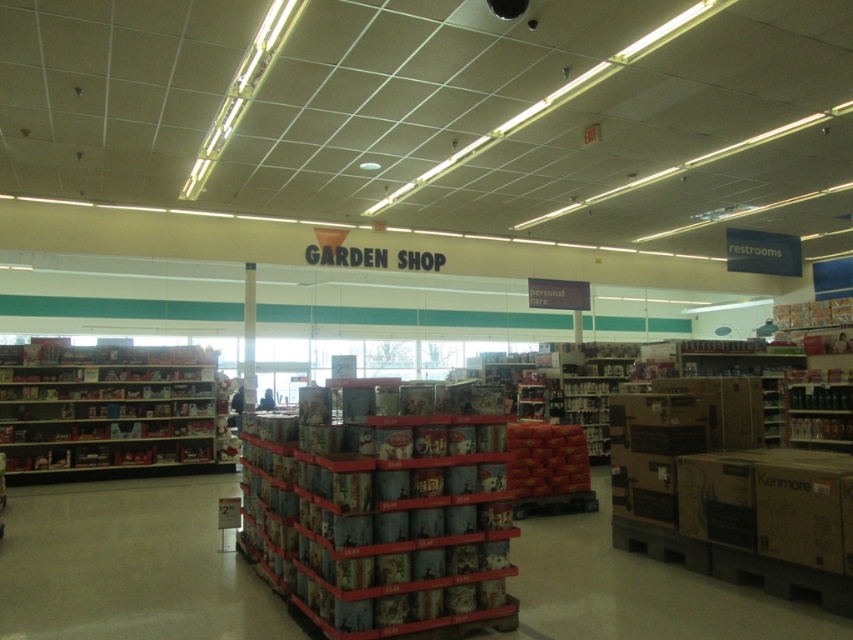
Question: Where is metallic silver cans at center located in relation to metallic silver shelves at left in the image?

Choices:
 (A) below
 (B) above

Answer: (B)

Question: Is metallic silver cans at center smaller than metallic silver shelves at left?

Choices:
 (A) no
 (B) yes

Answer: (B)

Question: Is metallic silver cans at center behind metallic silver shelves at left?

Choices:
 (A) no
 (B) yes

Answer: (A)

Question: Which point appears closest to the camera in this image?

Choices:
 (A) (28, 429)
 (B) (369, 548)

Answer: (B)

Question: Which object appears closest to the camera in this image?

Choices:
 (A) metallic silver cans at center
 (B) metallic silver shelves at left

Answer: (A)